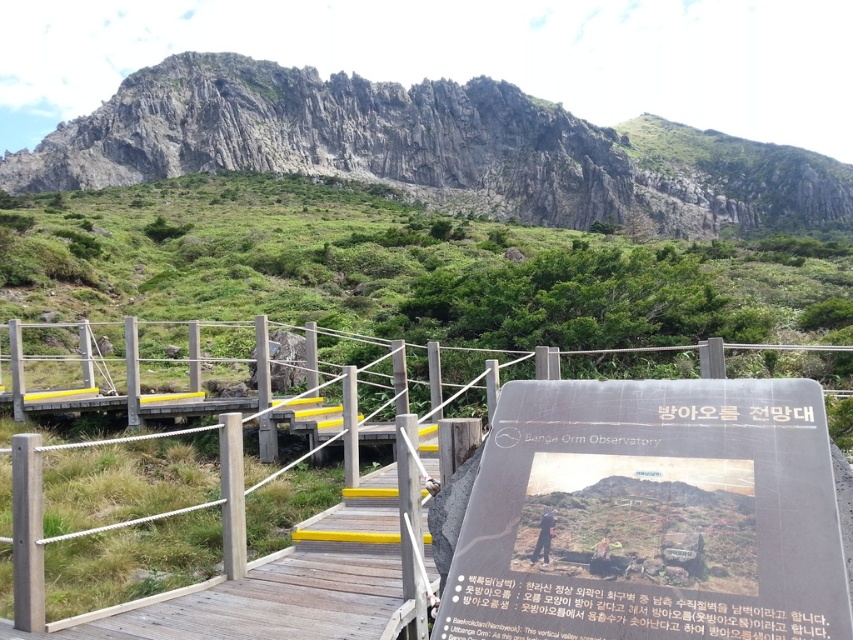
Question: In this image, where is black plastic sign at center located relative to rugged stone mountain at upper center?

Choices:
 (A) left
 (B) right

Answer: (A)

Question: Which of the following is the farthest from the observer?

Choices:
 (A) wooden rail at center
 (B) black plastic sign at center

Answer: (A)

Question: Estimate the real-world distances between objects in this image. Which object is closer to the rugged stone mountain at upper center?

Choices:
 (A) wooden rail at center
 (B) black plastic sign at center

Answer: (A)

Question: Can you confirm if black plastic sign at center is positioned below wooden rail at center?

Choices:
 (A) yes
 (B) no

Answer: (A)

Question: Which of these objects is positioned closest to the rugged stone mountain at upper center?

Choices:
 (A) wooden rail at center
 (B) black plastic sign at center

Answer: (A)

Question: Does black plastic sign at center lie in front of wooden rail at center?

Choices:
 (A) no
 (B) yes

Answer: (B)